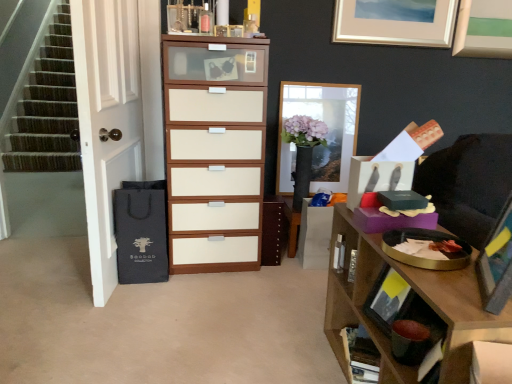
Identify the location of free space above wooden tray at upper right (from a real-world perspective). (441, 268).